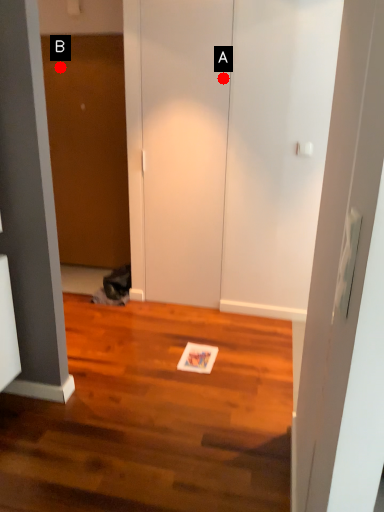
Question: Two points are circled on the image, labeled by A and B beside each circle. Which point appears closest to the camera in this image?

Choices:
 (A) A is closer
 (B) B is closer

Answer: (A)